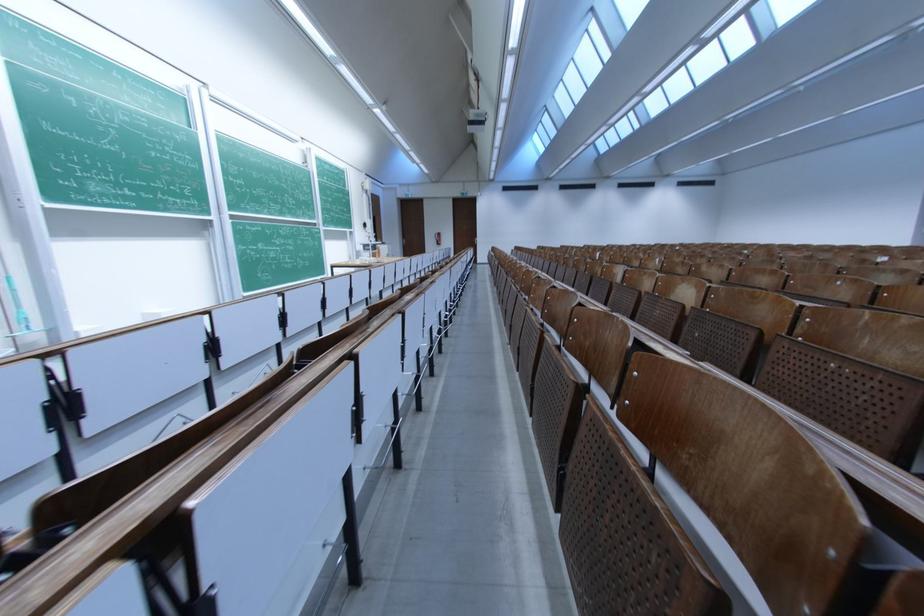
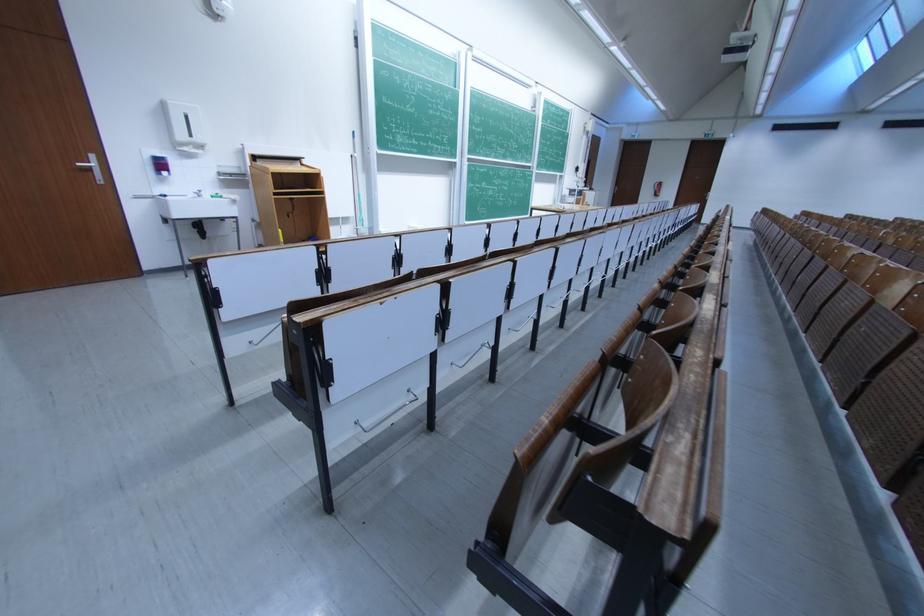
Where in the second image is the point corresponding to the point at 691,339 from the first image?

(860, 331)